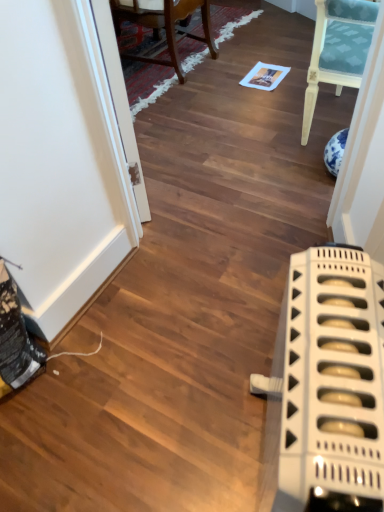
In order to click on free space in front of wooden chair at upper center in this screenshot , I will do `click(194, 108)`.